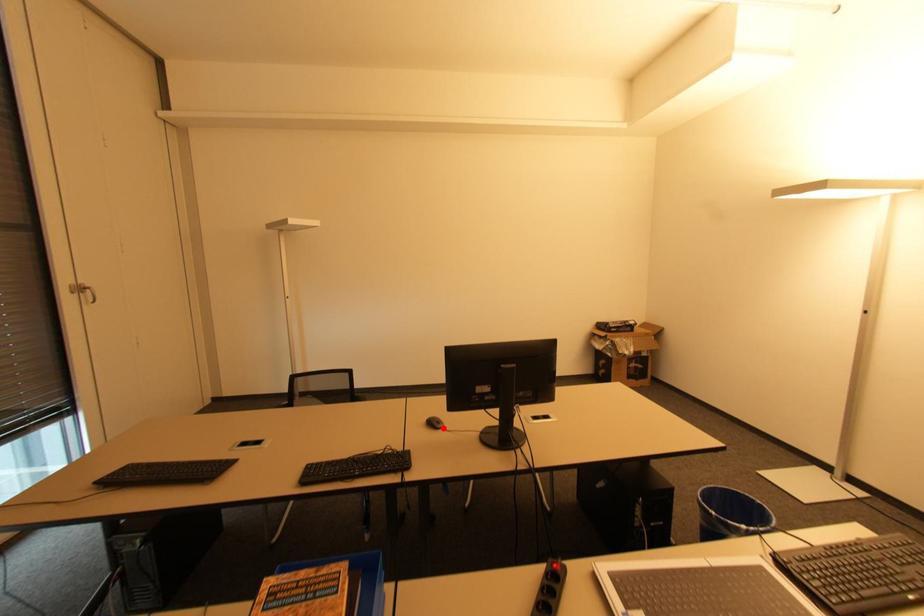
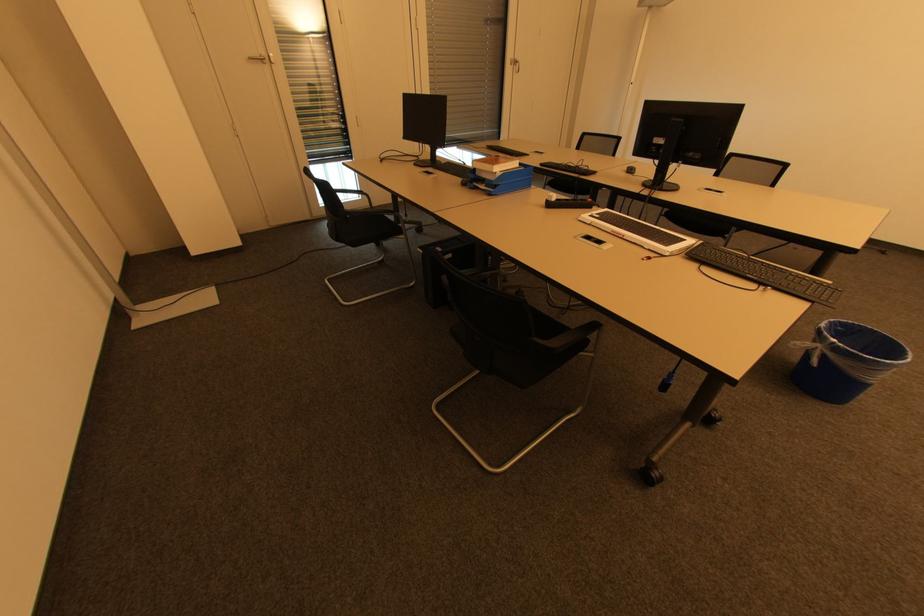
Locate, in the second image, the point that corresponds to the highlighted location in the first image.

(634, 174)